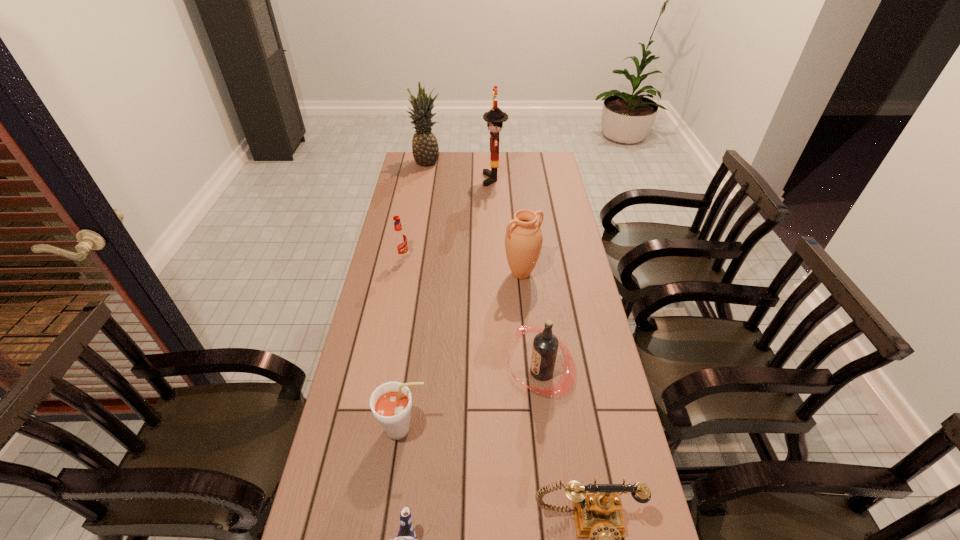
Image resolution: width=960 pixels, height=540 pixels. What are the coordinates of `free region located 0.290m on the front-facing side of the nutcracker` in the screenshot? It's located at (420, 179).

Where is `vacant space situated 0.200m on the front-facing side of the nutcracker`? This screenshot has width=960, height=540. vacant space situated 0.200m on the front-facing side of the nutcracker is located at coordinates (440, 179).

This screenshot has width=960, height=540. I want to click on free spot located 0.310m on the right of the pineapple, so click(x=506, y=161).

Locate an element on the screen. This screenshot has width=960, height=540. vacant area situated 0.360m on the front of the fifth nearest object is located at coordinates (531, 373).

Identify the location of free spot located on the label of the tallest root beer. The height and width of the screenshot is (540, 960). (396, 372).

I want to click on free region located on the label of the tallest root beer, so click(x=424, y=372).

Where is `free spot located on the label of the tallest root beer`? free spot located on the label of the tallest root beer is located at coordinates (463, 372).

Image resolution: width=960 pixels, height=540 pixels. What are the coordinates of `vacant area situated 0.310m on the front of the leftmost root beer` in the screenshot? It's located at (389, 326).

You are a GUI agent. You are given a task and a screenshot of the screen. Output one action in this format:
    pyautogui.click(x=<x>, y=<y>)
    Task: Click on the vacant point located on the drink side of the third nearest object
    The height and width of the screenshot is (540, 960).
    Given the screenshot: What is the action you would take?
    pyautogui.click(x=495, y=429)

At what (x,y) coordinates should I click in order to perform the action: click on nutcracker that is at the far edge. Please return your answer as a coordinate pair (x, y). Looking at the image, I should click on (495, 117).